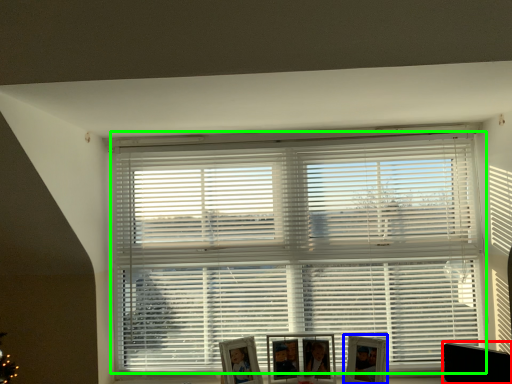
Question: Estimate the real-world distances between objects in this image. Which object is closer to swivel chair (highlighted by a red box), picture frame (highlighted by a blue box) or window blind (highlighted by a green box)?

Choices:
 (A) picture frame
 (B) window blind

Answer: (A)